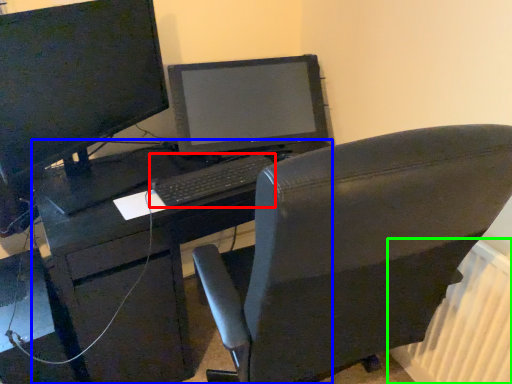
Question: Based on their relative distances, which object is nearer to computer keyboard (highlighted by a red box)? Choose from desk (highlighted by a blue box) and radiator (highlighted by a green box).

Choices:
 (A) desk
 (B) radiator

Answer: (A)